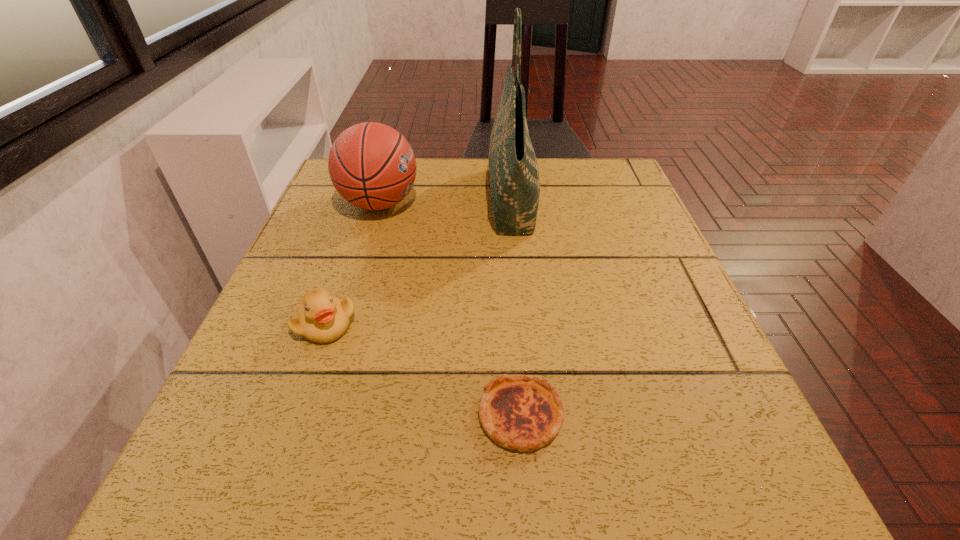
Image resolution: width=960 pixels, height=540 pixels. I want to click on vacant space that satisfies the following two spatial constraints: 1. on the logo side of the basketball; 2. on the beak of the second nearest object, so click(342, 324).

Locate an element on the screen. The image size is (960, 540). vacant space that satisfies the following two spatial constraints: 1. on the logo side of the nearest object; 2. on the right side of the second tallest object is located at coordinates (x=314, y=415).

Identify the location of free space that satisfies the following two spatial constraints: 1. on the logo side of the nearest object; 2. on the right side of the basketball. (314, 415).